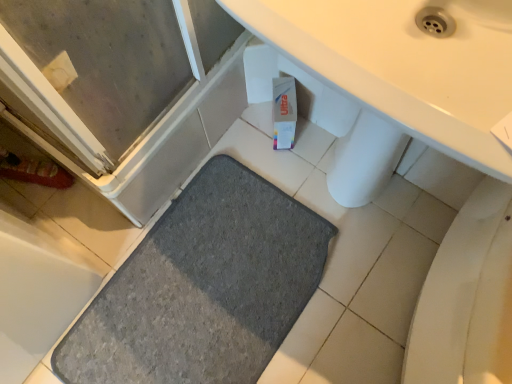
Question: Can you confirm if gray carpet at lower left is shorter than gray rubber mat at lower left?

Choices:
 (A) yes
 (B) no

Answer: (A)

Question: Considering the relative sizes of gray carpet at lower left and gray rubber mat at lower left in the image provided, is gray carpet at lower left bigger than gray rubber mat at lower left?

Choices:
 (A) no
 (B) yes

Answer: (A)

Question: Could you tell me if gray carpet at lower left is facing gray rubber mat at lower left?

Choices:
 (A) yes
 (B) no

Answer: (B)

Question: Is gray carpet at lower left outside gray rubber mat at lower left?

Choices:
 (A) yes
 (B) no

Answer: (A)

Question: Is gray carpet at lower left to the right of gray rubber mat at lower left from the viewer's perspective?

Choices:
 (A) no
 (B) yes

Answer: (B)

Question: Does gray carpet at lower left come behind gray rubber mat at lower left?

Choices:
 (A) yes
 (B) no

Answer: (A)

Question: From a real-world perspective, is gray rubber mat at lower left on gray carpet at lower left?

Choices:
 (A) no
 (B) yes

Answer: (B)

Question: Does gray rubber mat at lower left have a lesser height compared to gray carpet at lower left?

Choices:
 (A) yes
 (B) no

Answer: (B)

Question: Considering the relative sizes of gray rubber mat at lower left and gray carpet at lower left in the image provided, is gray rubber mat at lower left thinner than gray carpet at lower left?

Choices:
 (A) yes
 (B) no

Answer: (A)

Question: Can you confirm if gray rubber mat at lower left is positioned to the left of gray carpet at lower left?

Choices:
 (A) yes
 (B) no

Answer: (A)

Question: From a real-world perspective, is gray rubber mat at lower left located beneath gray carpet at lower left?

Choices:
 (A) no
 (B) yes

Answer: (A)

Question: Is gray rubber mat at lower left not near gray carpet at lower left?

Choices:
 (A) no
 (B) yes

Answer: (A)

Question: In the image, is gray rubber mat at lower left positioned in front of or behind gray carpet at lower left?

Choices:
 (A) behind
 (B) front

Answer: (B)